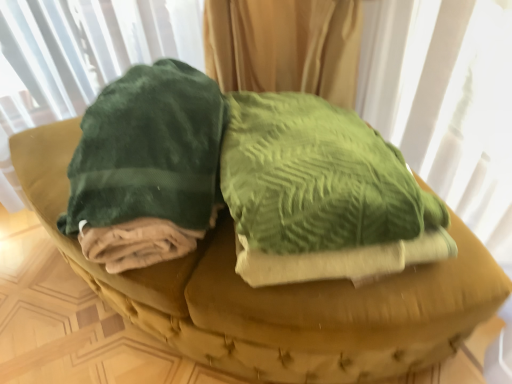
Question: Is velvety green blanket at left surrounding velvet green cushion at center?

Choices:
 (A) no
 (B) yes

Answer: (A)

Question: Is velvety green blanket at left bigger than velvet green cushion at center?

Choices:
 (A) yes
 (B) no

Answer: (B)

Question: Can we say velvety green blanket at left lies outside velvet green cushion at center?

Choices:
 (A) no
 (B) yes

Answer: (B)

Question: From a real-world perspective, does velvety green blanket at left sit lower than velvet green cushion at center?

Choices:
 (A) no
 (B) yes

Answer: (A)

Question: Can you confirm if velvety green blanket at left is positioned to the right of velvet green cushion at center?

Choices:
 (A) no
 (B) yes

Answer: (A)

Question: Is the depth of velvety green blanket at left greater than that of velvet green cushion at center?

Choices:
 (A) yes
 (B) no

Answer: (A)

Question: From the image's perspective, is velvet green cushion at center over velvety green blanket at left?

Choices:
 (A) yes
 (B) no

Answer: (B)

Question: Is velvet green cushion at center shorter than velvety green blanket at left?

Choices:
 (A) yes
 (B) no

Answer: (B)

Question: Considering the relative sizes of velvet green cushion at center and velvety green blanket at left in the image provided, is velvet green cushion at center taller than velvety green blanket at left?

Choices:
 (A) yes
 (B) no

Answer: (A)

Question: Could you tell me if velvet green cushion at center is turned towards velvety green blanket at left?

Choices:
 (A) no
 (B) yes

Answer: (A)

Question: Does velvet green cushion at center lie behind velvety green blanket at left?

Choices:
 (A) yes
 (B) no

Answer: (B)

Question: Is velvet green cushion at center positioned with its back to velvety green blanket at left?

Choices:
 (A) yes
 (B) no

Answer: (B)

Question: Considering the positions of point (471, 258) and point (184, 84), is point (471, 258) closer or farther from the camera than point (184, 84)?

Choices:
 (A) farther
 (B) closer

Answer: (B)